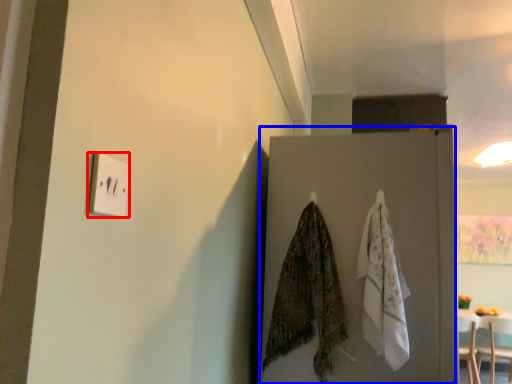
Question: Among these objects, which one is farthest to the camera, light switch (highlighted by a red box) or door (highlighted by a blue box)?

Choices:
 (A) light switch
 (B) door

Answer: (B)